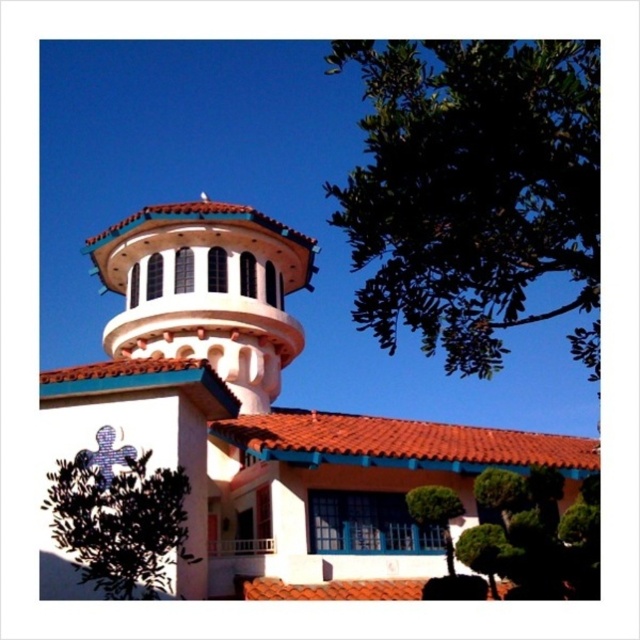
You are standing in front of the building and want to take a photo that includes both the white stucco bell tower at upper center and the terracotta tile roof at center. Which object should you ensure is in the background to capture both in the frame?

The white stucco bell tower at upper center is positioned over the terracotta tile roof at center, so to include both in the photo, you should ensure the terracotta tile roof at center is in the background while the white stucco bell tower at upper center is in the foreground.

You are an architect analyzing the building structure. You notice the white stucco bell tower at upper center and the terracotta tile roof at center. Which of these two elements is closer to your viewpoint?

The white stucco bell tower at upper center is closer to the viewer than the terracotta tile roof at center.